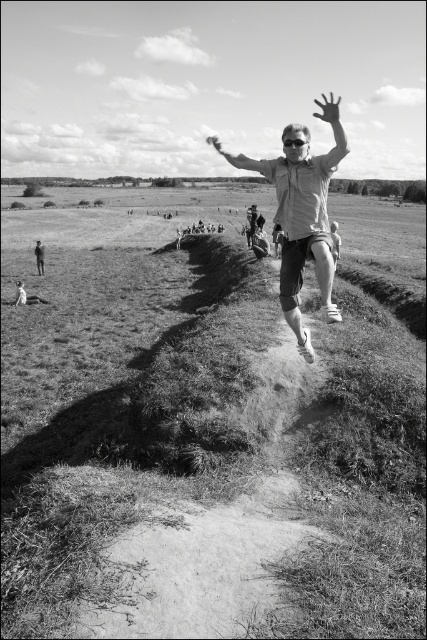
In the scene shown: Can you confirm if matte white shirt at center is taller than dark gray pants at lower left?

Correct, matte white shirt at center is much taller as dark gray pants at lower left.

Can you confirm if matte white shirt at center is smaller than dark gray pants at lower left?

Incorrect, matte white shirt at center is not smaller in size than dark gray pants at lower left.

Which is behind, point (257, 227) or point (38, 256)?

Point (257, 227)

I want to click on matte white shirt at center, so click(x=253, y=224).

Which is behind, point (6, 512) or point (40, 253)?

Positioned behind is point (40, 253).

Can you confirm if grassy hillside at center is thinner than dark gray pants at lower left?

No, grassy hillside at center is not thinner than dark gray pants at lower left.

Describe the element at coordinates (199, 436) in the screenshot. I see `grassy hillside at center` at that location.

Locate an element on the screen. grassy hillside at center is located at coordinates (199, 436).

Which is in front, point (306, 164) or point (20, 298)?

Positioned in front is point (306, 164).

Who is shorter, light gray casual shirt at center or smooth skin person at lower left?

Standing shorter between the two is smooth skin person at lower left.

Describe the element at coordinates (301, 225) in the screenshot. I see `light gray casual shirt at center` at that location.

Where is `light gray casual shirt at center`? Image resolution: width=427 pixels, height=640 pixels. light gray casual shirt at center is located at coordinates (301, 225).